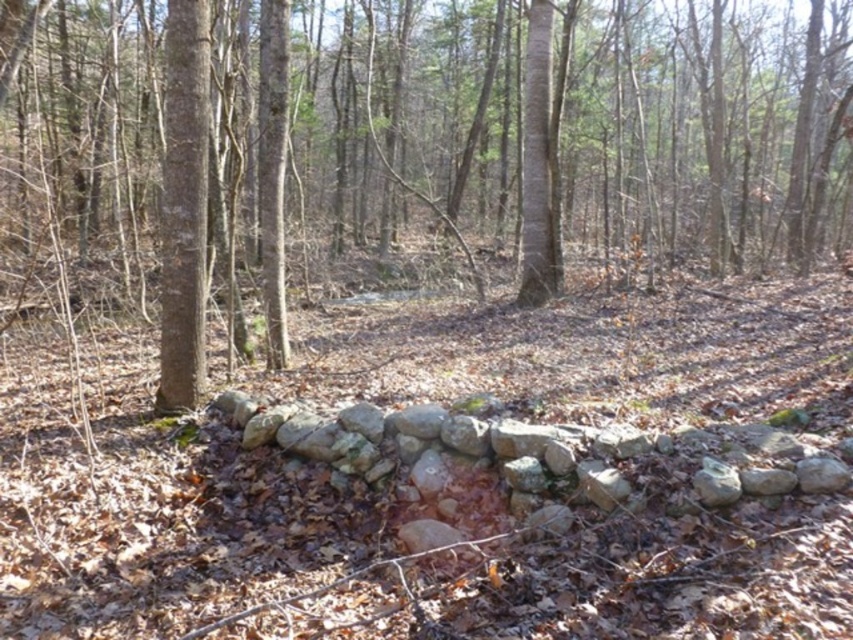
You are a hiker walking along a forest path and see both the brown rough tree at center and the smooth bark tree at center. Which tree would block your view of the other tree?

The brown rough tree at center is in front of the smooth bark tree at center, so it would block your view of the smooth bark tree at center.

You are a hiker trying to navigate through the forest and need to identify the trees. Which tree, the brown rough tree at center or the smooth bark tree at center, would you estimate to be taller?

The brown rough tree at center is larger in size compared to the smooth bark tree at center, so it would be the taller one.

You are standing at the center of the forest scene. You want to locate the brown rough tree at center. According to the coordinates provided, where should you look?

The brown rough tree at center is located at coordinates point [405,152].